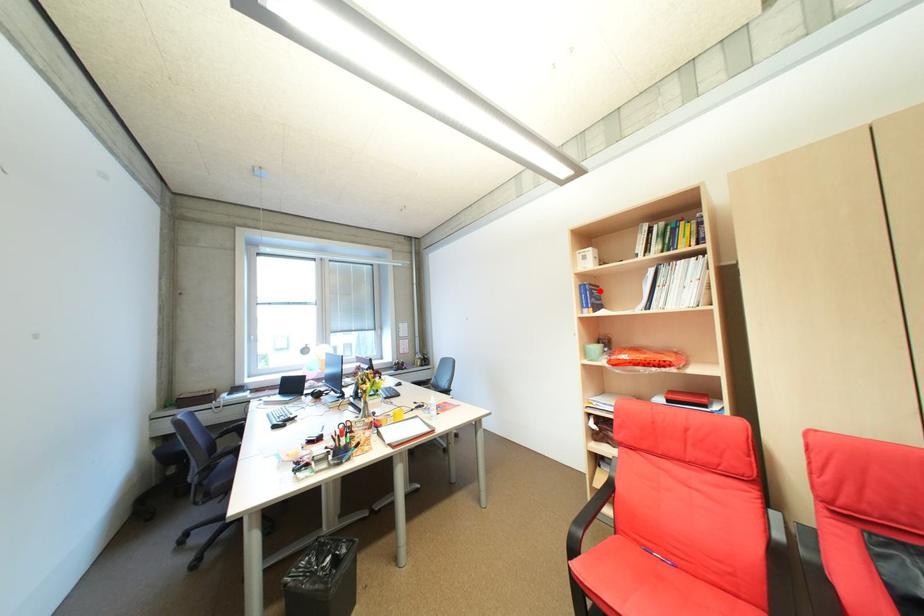
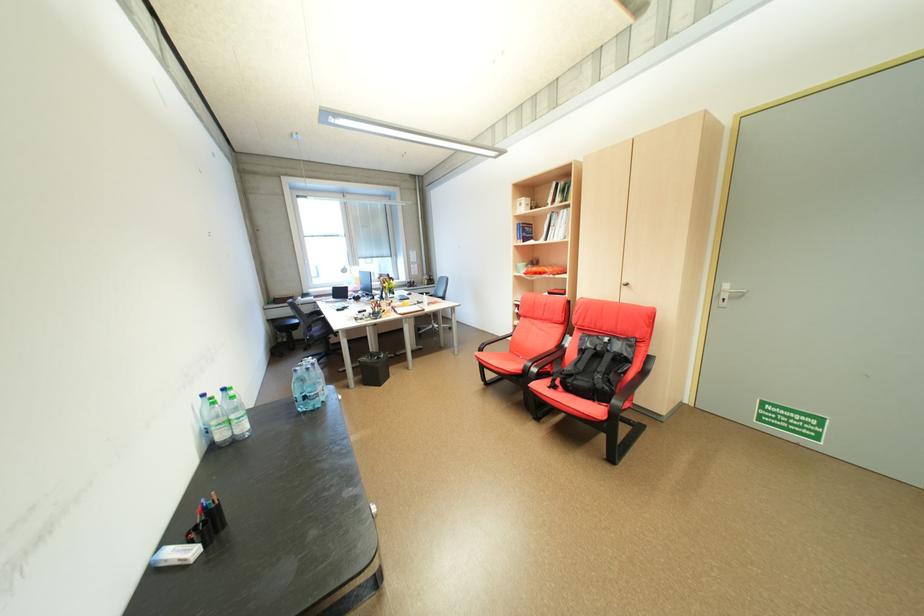
Question: I am providing you with two images of the same scene from different viewpoints. A red point is shown in image1. For the corresponding object point in image2, is it positioned nearer or farther from the camera?

Choices:
 (A) Nearer
 (B) Farther

Answer: (A)